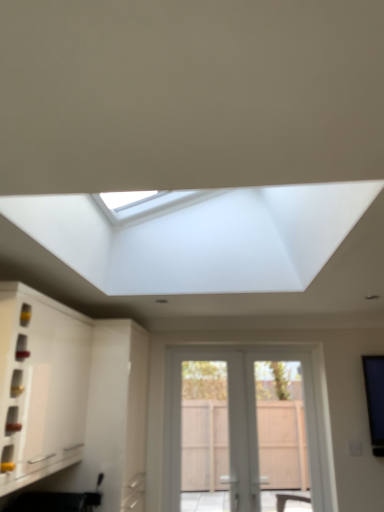
Image resolution: width=384 pixels, height=512 pixels. What do you see at coordinates (242, 426) in the screenshot?
I see `white wooden door at center` at bounding box center [242, 426].

This screenshot has height=512, width=384. I want to click on white wooden door at center, so click(x=242, y=426).

This screenshot has height=512, width=384. What do you see at coordinates (40, 385) in the screenshot?
I see `white matte cabinet at left` at bounding box center [40, 385].

Where is `white matte cabinet at left`? The width and height of the screenshot is (384, 512). white matte cabinet at left is located at coordinates (40, 385).

Locate an element on the screen. The image size is (384, 512). white wooden door at center is located at coordinates (242, 426).

Which is more to the right, white wooden door at center or white matte cabinet at left?

white wooden door at center.

Is white wooden door at center further to the viewer compared to white matte cabinet at left?

Yes.

Is point (232, 370) in front of point (6, 457)?

That is False.

From the image's perspective, between white wooden door at center and white matte cabinet at left, who is located below?

From the image's view, white wooden door at center is below.

From a real-world perspective, is white wooden door at center physically below white matte cabinet at left?

Indeed, from a real-world perspective, white wooden door at center is positioned beneath white matte cabinet at left.

Can you confirm if white wooden door at center is thinner than white matte cabinet at left?

Correct, the width of white wooden door at center is less than that of white matte cabinet at left.

Considering the sizes of objects white wooden door at center and white matte cabinet at left in the image provided, who is taller, white wooden door at center or white matte cabinet at left?

Standing taller between the two is white wooden door at center.

Who is bigger, white wooden door at center or white matte cabinet at left?

white matte cabinet at left is bigger.

Choose the correct answer: Is white wooden door at center inside white matte cabinet at left or outside it?

white wooden door at center is not inside white matte cabinet at left, it's outside.

Is white wooden door at center placed right next to white matte cabinet at left?

No, white wooden door at center is not touching white matte cabinet at left.

Is white wooden door at center facing towards white matte cabinet at left?

No, white wooden door at center is not turned towards white matte cabinet at left.

How distant is white wooden door at center from white matte cabinet at left?

A distance of 1.46 meters exists between white wooden door at center and white matte cabinet at left.

Locate an element on the screen. The image size is (384, 512). cabinetry that appears above the white wooden door at center (from a real-world perspective) is located at coordinates (40, 385).

Visually, is white matte cabinet at left positioned to the left or to the right of white wooden door at center?

white matte cabinet at left is positioned on white wooden door at center's left side.

Does white matte cabinet at left come in front of white wooden door at center?

Yes, the depth of white matte cabinet at left is less than that of white wooden door at center.

Considering the points (45, 370) and (207, 439), which point is behind, point (45, 370) or point (207, 439)?

Positioned behind is point (207, 439).

From the image's perspective, would you say white matte cabinet at left is positioned over white wooden door at center?

Yes, from the image's perspective, white matte cabinet at left is over white wooden door at center.

In the scene shown: From a real-world perspective, is white matte cabinet at left beneath white wooden door at center?

No, from a real-world perspective, white matte cabinet at left is not beneath white wooden door at center.

Does white matte cabinet at left have a lesser width compared to white wooden door at center?

In fact, white matte cabinet at left might be wider than white wooden door at center.

Considering the sizes of white matte cabinet at left and white wooden door at center in the image, is white matte cabinet at left taller or shorter than white wooden door at center?

In the image, white matte cabinet at left appears to be shorter than white wooden door at center.

Does white matte cabinet at left have a smaller size compared to white wooden door at center?

Actually, white matte cabinet at left might be larger than white wooden door at center.

Choose the correct answer: Is white matte cabinet at left inside white wooden door at center or outside it?

white matte cabinet at left is spatially situated outside white wooden door at center.

From the picture: Is white matte cabinet at left not near white wooden door at center?

Absolutely, white matte cabinet at left is distant from white wooden door at center.

Is white matte cabinet at left facing away from white wooden door at center?

No, white wooden door at center is not at the back of white matte cabinet at left.

In the scene shown: What's the angular difference between white matte cabinet at left and white wooden door at center's facing directions?

The angle between the facing direction of white matte cabinet at left and the facing direction of white wooden door at center is 89.6 degrees.

Locate an element on the screen. door below the white matte cabinet at left (from a real-world perspective) is located at coordinates (242, 426).

Identify the location of cabinetry above the white wooden door at center (from a real-world perspective). (40, 385).

Locate an element on the screen. cabinetry in front of the white wooden door at center is located at coordinates (40, 385).